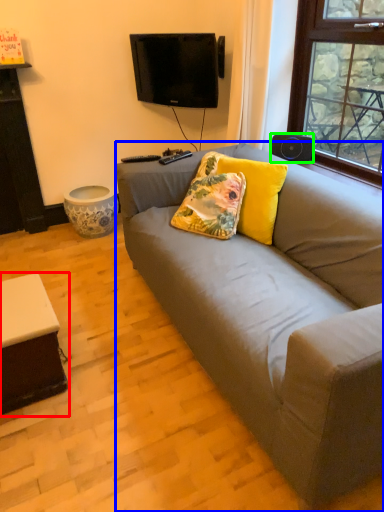
Question: Which object is positioned closest to table (highlighted by a red box)? Select from studio couch (highlighted by a blue box) and loudspeaker (highlighted by a green box).

Choices:
 (A) studio couch
 (B) loudspeaker

Answer: (A)